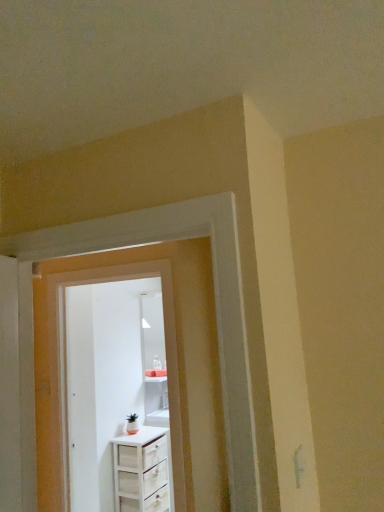
Question: From a real-world perspective, is white glossy door at center, the second door positioned from the back, under white wood chest of drawers at center?

Choices:
 (A) no
 (B) yes

Answer: (A)

Question: Is white glossy door at center, the second door positioned from the back, facing towards white wood chest of drawers at center?

Choices:
 (A) no
 (B) yes

Answer: (A)

Question: Is white glossy door at center, the second door positioned from the back, in contact with white wood chest of drawers at center?

Choices:
 (A) yes
 (B) no

Answer: (B)

Question: Is white glossy door at center, the second door positioned from the back, to the left of white wood chest of drawers at center from the viewer's perspective?

Choices:
 (A) yes
 (B) no

Answer: (A)

Question: Are white glossy door at center, the 1th door in the front-to-back sequence, and white wood chest of drawers at center far apart?

Choices:
 (A) yes
 (B) no

Answer: (B)

Question: From the image's perspective, is white glossy door at center, the second door positioned from the back, on white wood chest of drawers at center?

Choices:
 (A) yes
 (B) no

Answer: (A)

Question: From a real-world perspective, is white glossy door at center, the second door positioned from the back, located higher than white wood door at center, the second door viewed from the front?

Choices:
 (A) yes
 (B) no

Answer: (A)

Question: From the image's perspective, is white glossy door at center, the second door positioned from the back, located beneath white wood door at center, the second door viewed from the front?

Choices:
 (A) no
 (B) yes

Answer: (A)

Question: Can you confirm if white glossy door at center, the 1th door in the front-to-back sequence, is wider than white wood door at center, the first door from the back?

Choices:
 (A) yes
 (B) no

Answer: (B)

Question: From the image's perspective, does white glossy door at center, the 1th door in the front-to-back sequence, appear higher than white wood door at center, the second door viewed from the front?

Choices:
 (A) no
 (B) yes

Answer: (B)

Question: Is white glossy door at center, the second door positioned from the back, to the right of white wood door at center, the second door viewed from the front, from the viewer's perspective?

Choices:
 (A) yes
 (B) no

Answer: (A)

Question: Would you say white glossy door at center, the second door positioned from the back, contains white wood door at center, the first door from the back?

Choices:
 (A) no
 (B) yes

Answer: (A)

Question: Are white wood chest of drawers at center and white wood door at center, the second door viewed from the front, located far from each other?

Choices:
 (A) no
 (B) yes

Answer: (A)